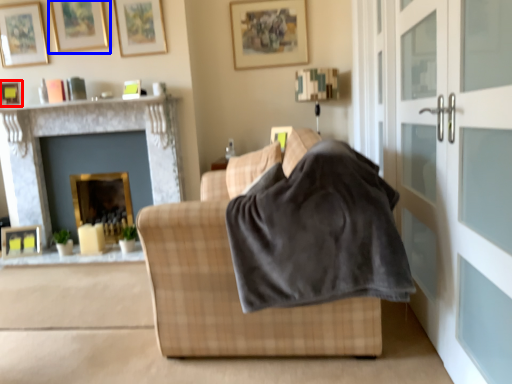
Question: Which of the following is the closest to the observer, picture frame (highlighted by a red box) or picture frame (highlighted by a blue box)?

Choices:
 (A) picture frame
 (B) picture frame

Answer: (A)